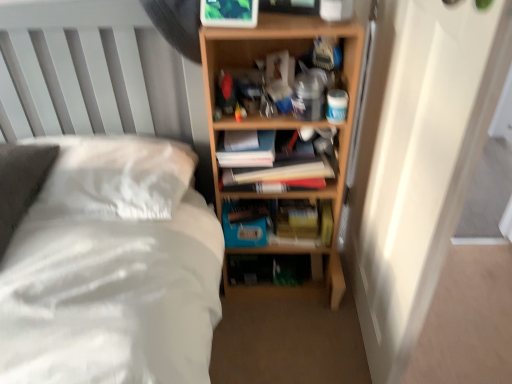
Question: From the image's perspective, is hardcover books at center below white soft bed at center?

Choices:
 (A) yes
 (B) no

Answer: (B)

Question: Is hardcover books at center bigger than white soft bed at center?

Choices:
 (A) yes
 (B) no

Answer: (B)

Question: Is hardcover books at center in contact with white soft bed at center?

Choices:
 (A) no
 (B) yes

Answer: (A)

Question: Is hardcover books at center closer to camera compared to white soft bed at center?

Choices:
 (A) no
 (B) yes

Answer: (A)

Question: Is hardcover books at center at the right side of white soft bed at center?

Choices:
 (A) yes
 (B) no

Answer: (A)

Question: Is hardcover books at center in front of or behind white soft bed at center in the image?

Choices:
 (A) front
 (B) behind

Answer: (B)

Question: Choose the correct answer: Is hardcover books at center inside white soft bed at center or outside it?

Choices:
 (A) outside
 (B) inside

Answer: (A)

Question: Considering the relative positions of hardcover books at center and white soft bed at center in the image provided, is hardcover books at center to the left or to the right of white soft bed at center?

Choices:
 (A) left
 (B) right

Answer: (B)

Question: Considering the positions of hardcover books at center and white soft bed at center in the image, is hardcover books at center wider or thinner than white soft bed at center?

Choices:
 (A) thin
 (B) wide

Answer: (A)

Question: From a real-world perspective, is white soft bed at center physically located above or below blue matte paperback book at center?

Choices:
 (A) below
 (B) above

Answer: (B)

Question: In terms of width, does white soft bed at center look wider or thinner when compared to blue matte paperback book at center?

Choices:
 (A) wide
 (B) thin

Answer: (A)

Question: Is point (158, 175) closer or farther from the camera than point (225, 221)?

Choices:
 (A) farther
 (B) closer

Answer: (B)

Question: In terms of height, does white soft bed at center look taller or shorter compared to blue matte paperback book at center?

Choices:
 (A) tall
 (B) short

Answer: (A)

Question: Is blue matte paperback book at center wider or thinner than white soft bed at center?

Choices:
 (A) wide
 (B) thin

Answer: (B)

Question: From a real-world perspective, is blue matte paperback book at center above or below white soft bed at center?

Choices:
 (A) above
 (B) below

Answer: (B)